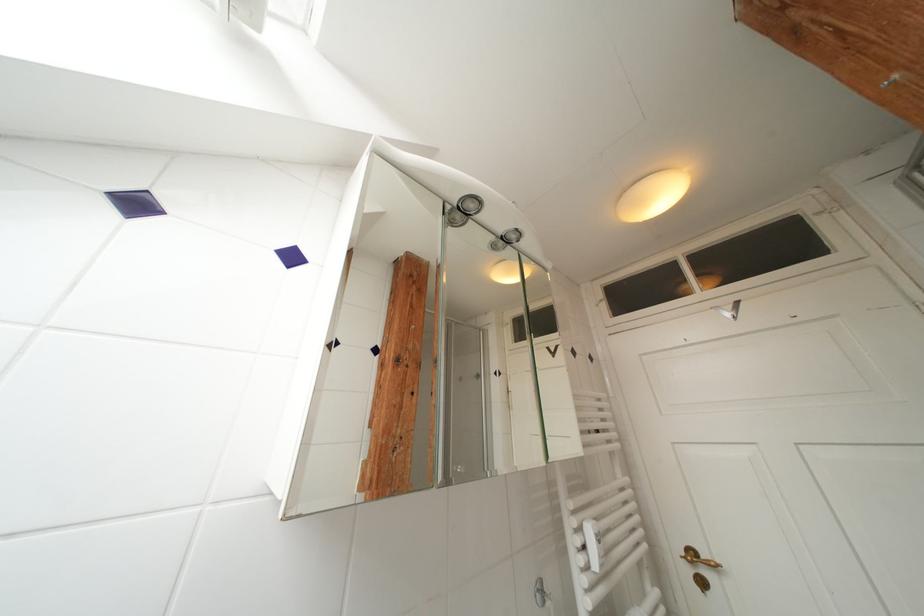
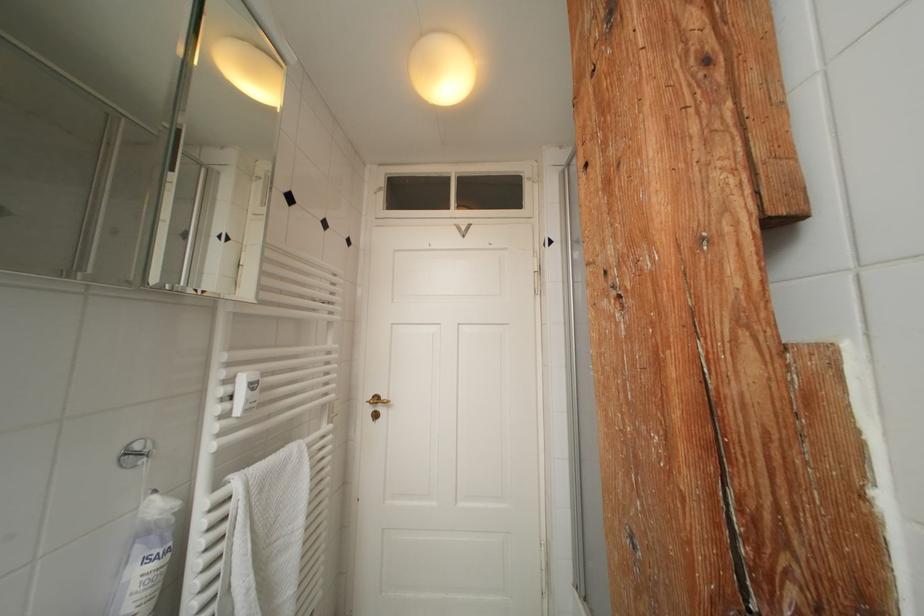
Question: The images are taken continuously from a first-person perspective. In which direction is your viewpoint rotating?

Choices:
 (A) Left
 (B) Right
 (C) Up
 (D) Down

Answer: (B)